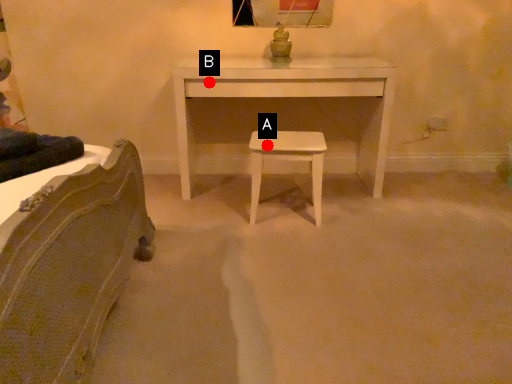
Question: Two points are circled on the image, labeled by A and B beside each circle. Among these points, which one is farthest from the camera?

Choices:
 (A) A is further
 (B) B is further

Answer: (B)